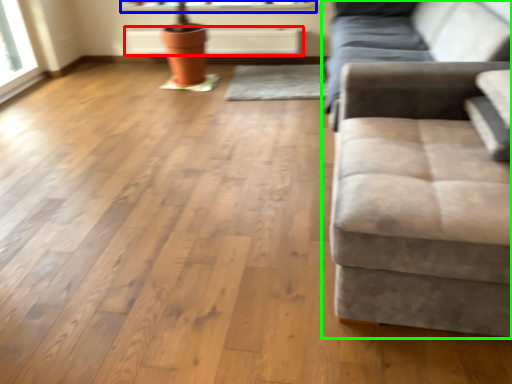
Question: Based on their relative distances, which object is nearer to radiator (highlighted by a red box)? Choose from window sill (highlighted by a blue box) and studio couch (highlighted by a green box).

Choices:
 (A) window sill
 (B) studio couch

Answer: (A)